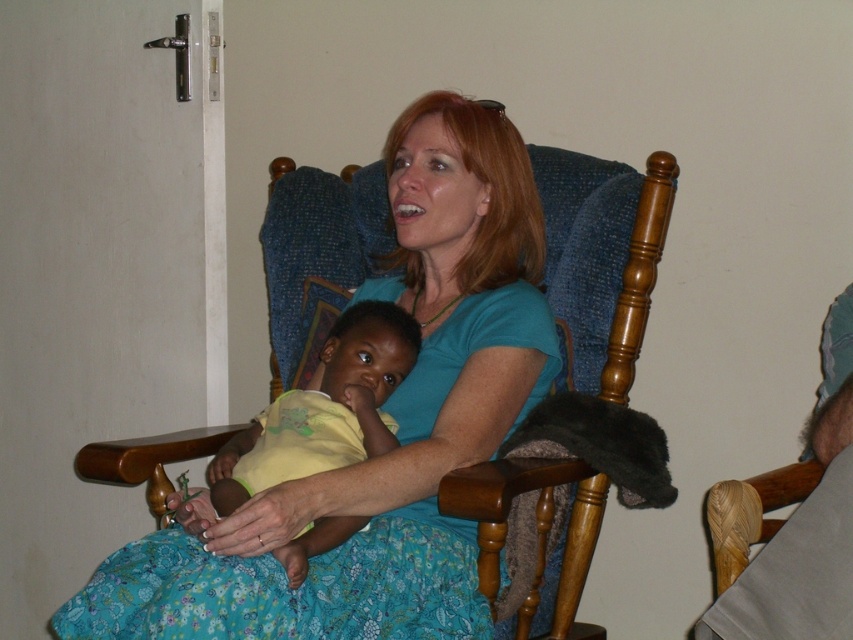
Question: Does blue cotton shirt at center have a lesser width compared to yellow matte baby at center?

Choices:
 (A) yes
 (B) no

Answer: (B)

Question: Which point is closer to the camera?

Choices:
 (A) blue cotton shirt at center
 (B) yellow matte baby at center

Answer: (A)

Question: Where is blue cotton shirt at center located in relation to yellow matte baby at center in the image?

Choices:
 (A) below
 (B) above

Answer: (B)

Question: Is blue cotton shirt at center closer to the viewer compared to yellow matte baby at center?

Choices:
 (A) yes
 (B) no

Answer: (A)